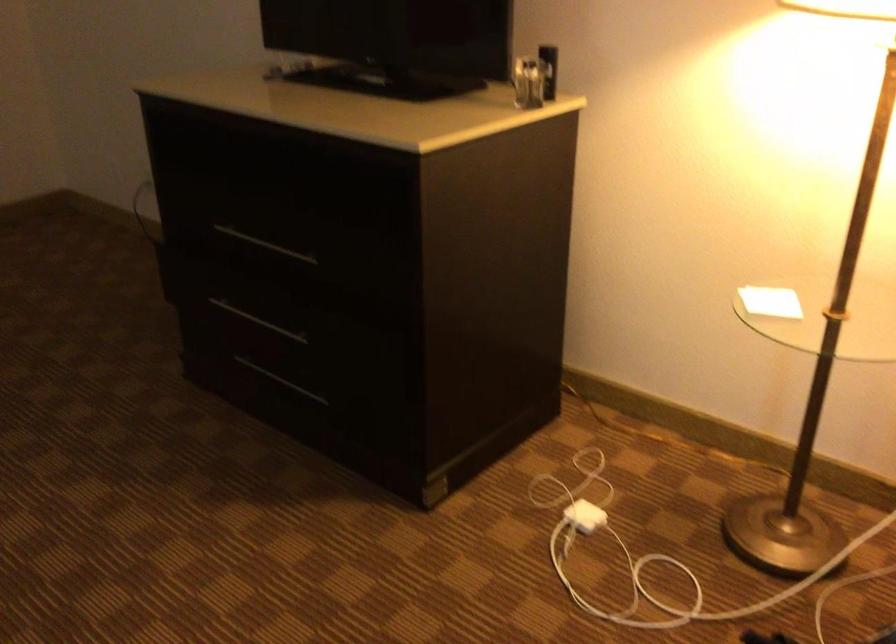
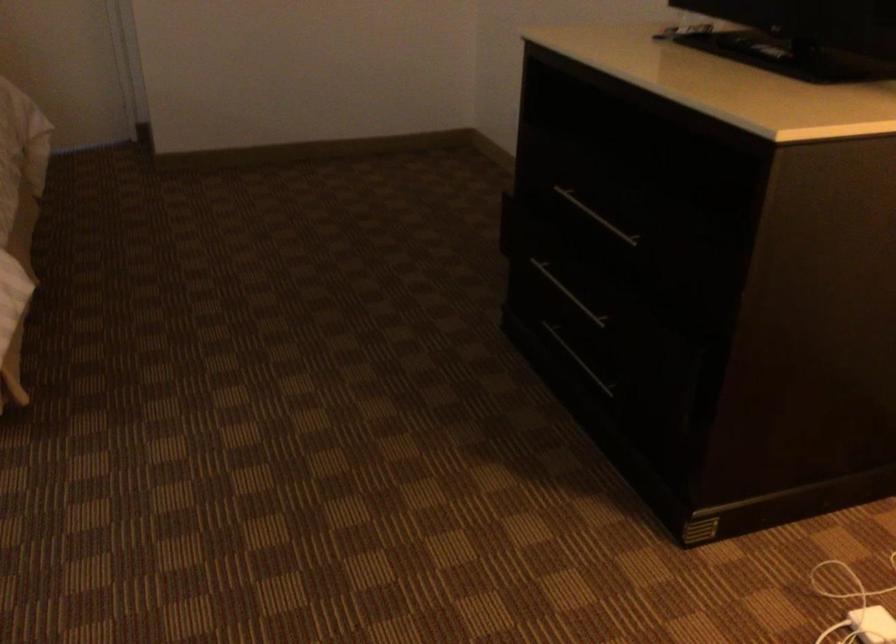
Where in the second image is the point corresponding to (279,382) from the first image?

(579, 360)